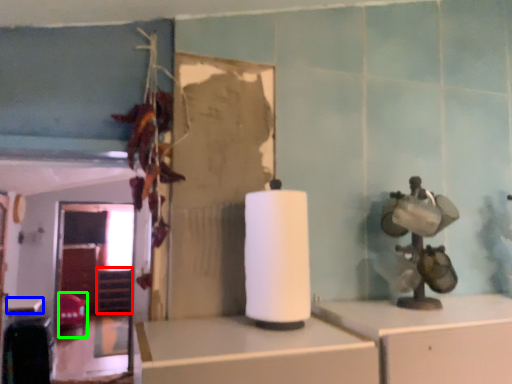
Question: Considering the real-world distances, which object is farthest from shelf (highlighted by a red box)? table (highlighted by a blue box) or chair (highlighted by a green box)?

Choices:
 (A) table
 (B) chair

Answer: (A)